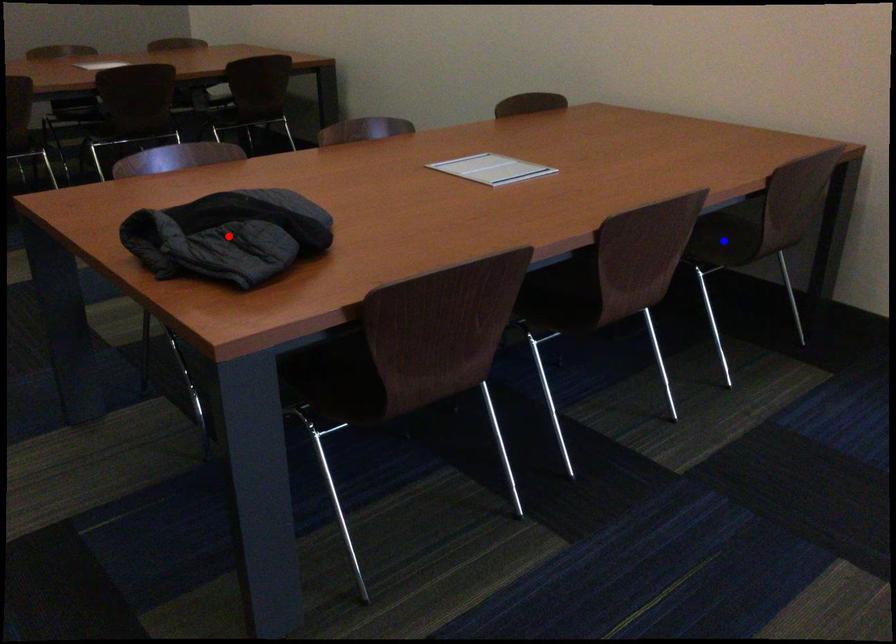
Question: Two points are marked on the image. Which point is closer to the camera?

Choices:
 (A) Blue point is closer.
 (B) Red point is closer.

Answer: (B)